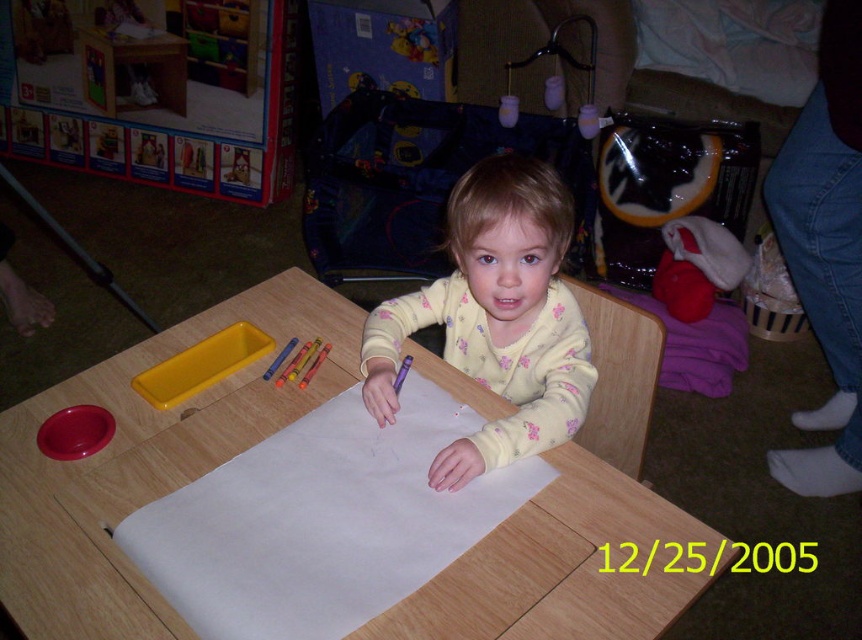
Consider the image. You are standing in a playroom and want to place a small toy on the table where the child is drawing. The toy requires a space exactly 80 centimeters away from you to function properly. Is the point at coordinates point (105, 625) on the table suitable for placing the toy?

The distance of point (105, 625) from viewer is 79.56 centimeters, which is slightly less than the required 80 centimeters. Therefore, placing the toy at point (105, 625) may not meet the distance requirement.

You are a parent looking for your child who is wearing fluffy yellow pajamas at center. You see the wooden table at center in the room. Which object is on the right side from your perspective?

The fluffy yellow pajamas at center are on the right side from your perspective because the wooden table at center is to its left.